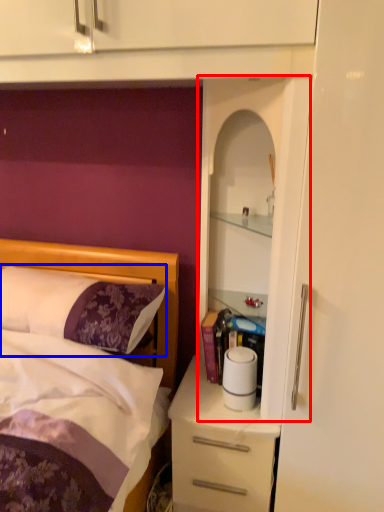
Question: Among these objects, which one is farthest to the camera, cabinet (highlighted by a red box) or pillow (highlighted by a blue box)?

Choices:
 (A) cabinet
 (B) pillow

Answer: (B)